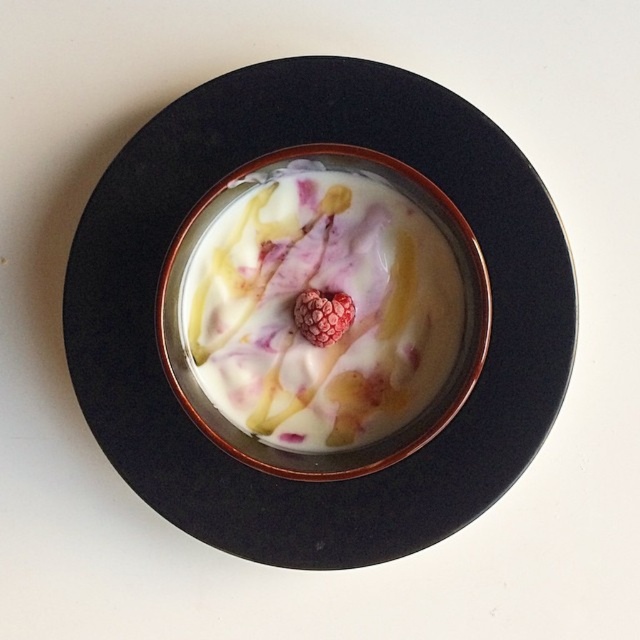
This screenshot has height=640, width=640. What do you see at coordinates (160, 276) in the screenshot?
I see `black ceramic bowl at center` at bounding box center [160, 276].

Which is behind, point (413, 516) or point (314, 340)?

The point (314, 340) is behind.

Describe the element at coordinates (160, 276) in the screenshot. I see `black ceramic bowl at center` at that location.

This screenshot has width=640, height=640. What are the coordinates of `black ceramic bowl at center` in the screenshot? It's located at (160, 276).

Which is behind, point (484, 403) or point (376, 298)?

Positioned behind is point (376, 298).

Between black ceramic bowl at center and white creamy yogurt at center, which one is positioned lower?

Positioned lower is white creamy yogurt at center.

Does point (172, 435) come closer to viewer compared to point (376, 292)?

Yes, it is in front of point (376, 292).

Identify the location of black ceramic bowl at center. Image resolution: width=640 pixels, height=640 pixels. (160, 276).

Who is taller, white creamy yogurt at center or raspberry at center?

white creamy yogurt at center

Does point (365, 289) come in front of point (296, 326)?

Yes.

Is point (291, 356) behind point (332, 317)?

Yes, point (291, 356) is farther from viewer.

This screenshot has height=640, width=640. In order to click on white creamy yogurt at center in this screenshot , I will do `click(323, 291)`.